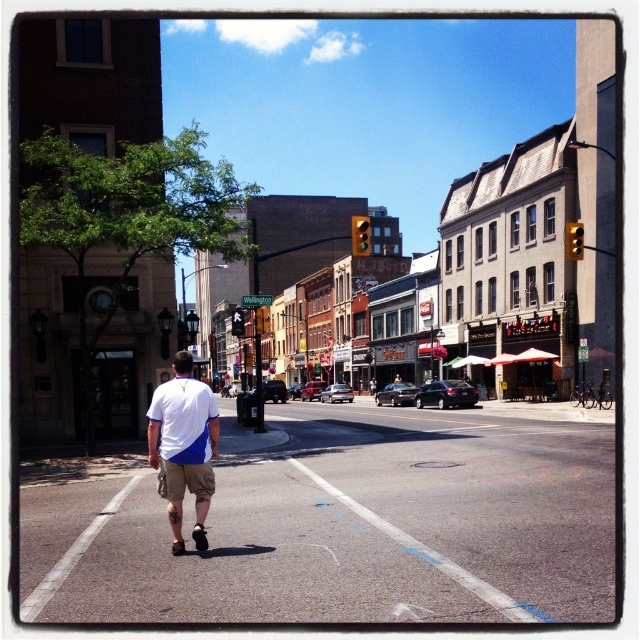
Is yellow plastic traffic light at center thinner than yellow glass pedestrian signal at center?

Yes, yellow plastic traffic light at center is thinner than yellow glass pedestrian signal at center.

Which is below, yellow plastic traffic light at center or yellow glass pedestrian signal at center?

yellow glass pedestrian signal at center

Between point (362, 253) and point (241, 308), which one is positioned in front?

Point (362, 253) is more forward.

At what (x,y) coordinates should I click in order to perform the action: click on yellow plastic traffic light at center. Please return your answer as a coordinate pair (x, y). The width and height of the screenshot is (640, 640). Looking at the image, I should click on (360, 236).

Is khaki shorts at center below yellow glass pedestrian signal at center?

Indeed, khaki shorts at center is positioned under yellow glass pedestrian signal at center.

Is khaki shorts at center positioned in front of yellow glass pedestrian signal at center?

Yes.

What do you see at coordinates (182, 445) in the screenshot? This screenshot has height=640, width=640. I see `khaki shorts at center` at bounding box center [182, 445].

Locate an element on the screen. khaki shorts at center is located at coordinates (182, 445).

Does point (212, 417) come in front of point (365, 250)?

Yes, point (212, 417) is in front of point (365, 250).

Between point (180, 435) and point (365, 220), which one is positioned in front?

Positioned in front is point (180, 435).

Locate an element on the screen. khaki shorts at center is located at coordinates (182, 445).